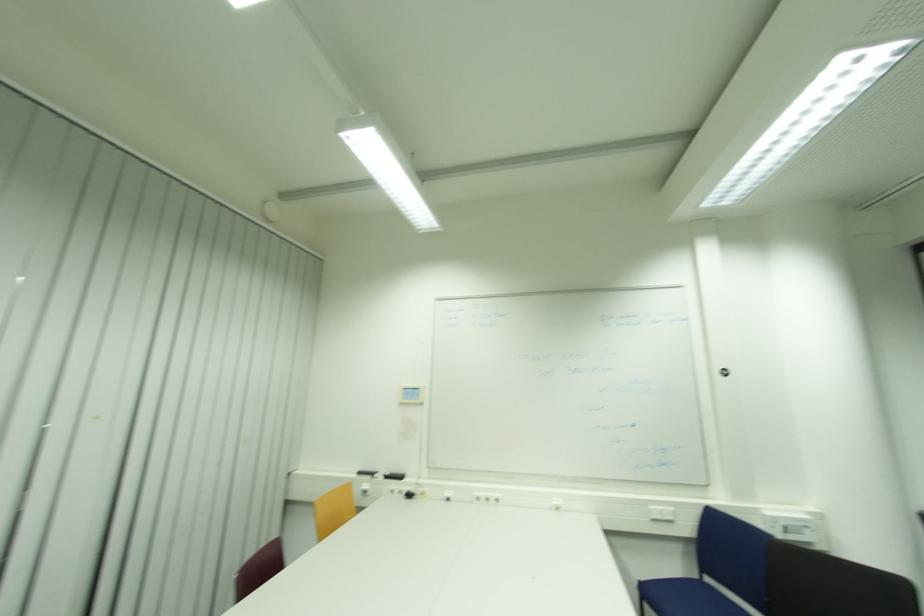
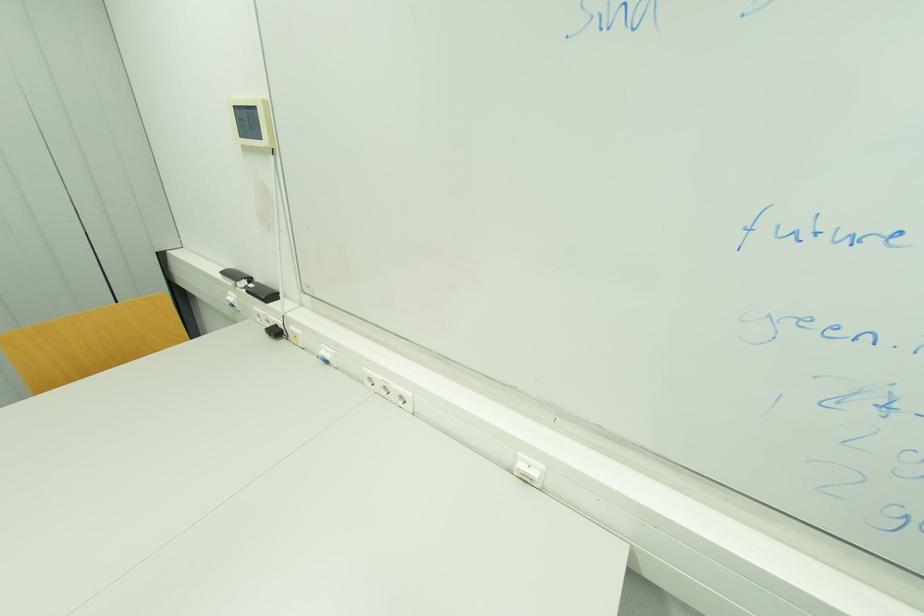
Find the pixel in the second image that matches pixel 414 496 in the first image.

(281, 333)